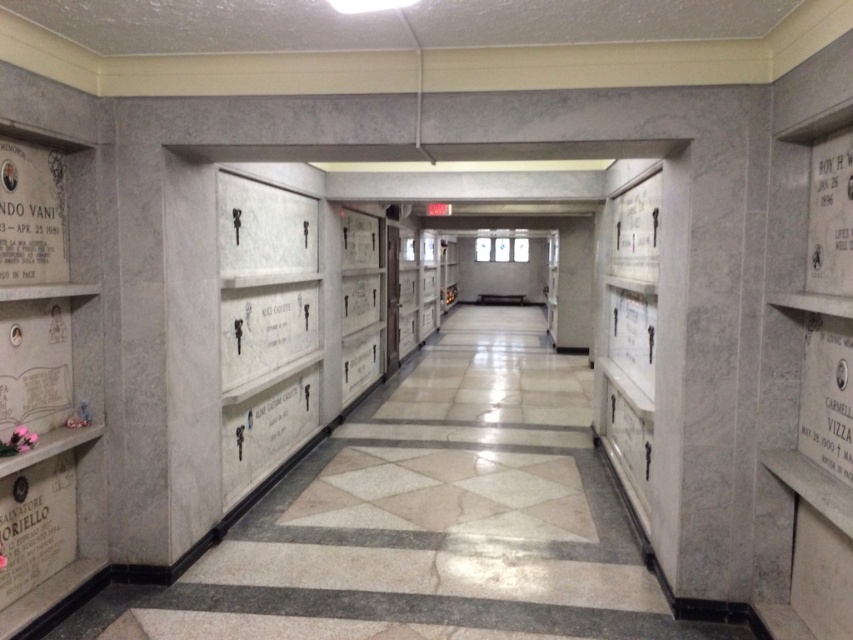
Question: Which of the following is the farthest from the observer?

Choices:
 (A) black marble plaque at left
 (B) white marble crypts at left

Answer: (B)

Question: In this image, where is white marble crypts at left located relative to black marble plaque at left?

Choices:
 (A) left
 (B) right

Answer: (B)

Question: Is white marble crypts at left bigger than black marble plaque at left?

Choices:
 (A) no
 (B) yes

Answer: (B)

Question: Does white marble crypts at left have a greater width compared to black marble plaque at left?

Choices:
 (A) no
 (B) yes

Answer: (B)

Question: Which point is closer to the camera?

Choices:
 (A) (281, 577)
 (B) (55, 268)

Answer: (B)